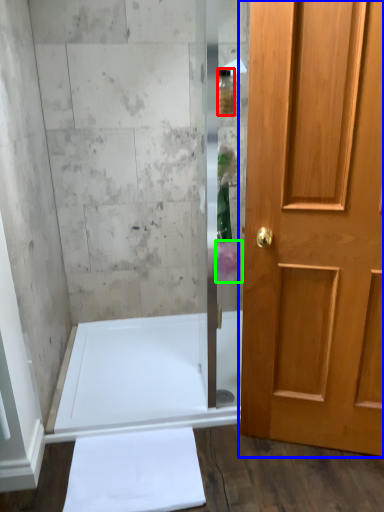
Question: Which object is positioned farthest from toiletry (highlighted by a red box)? Select from door (highlighted by a blue box) and flower (highlighted by a green box).

Choices:
 (A) door
 (B) flower

Answer: (A)